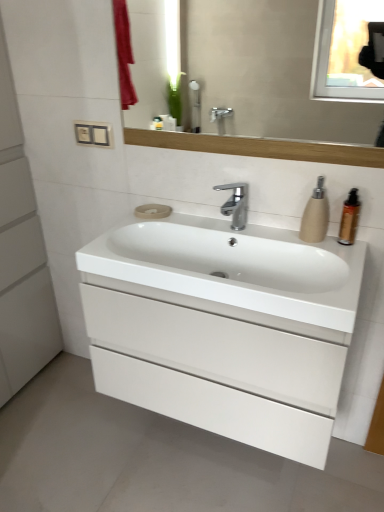
Question: Considering the relative sizes of brown glossy bottle at right and matte wooden mirror at upper center in the image provided, is brown glossy bottle at right thinner than matte wooden mirror at upper center?

Choices:
 (A) yes
 (B) no

Answer: (B)

Question: From a real-world perspective, is brown glossy bottle at right under matte wooden mirror at upper center?

Choices:
 (A) yes
 (B) no

Answer: (A)

Question: Considering the relative positions of brown glossy bottle at right and matte wooden mirror at upper center in the image provided, is brown glossy bottle at right to the right of matte wooden mirror at upper center from the viewer's perspective?

Choices:
 (A) no
 (B) yes

Answer: (B)

Question: Is brown glossy bottle at right facing towards matte wooden mirror at upper center?

Choices:
 (A) yes
 (B) no

Answer: (B)

Question: From a real-world perspective, is brown glossy bottle at right physically above matte wooden mirror at upper center?

Choices:
 (A) yes
 (B) no

Answer: (B)

Question: Can you confirm if brown glossy bottle at right is positioned to the left of matte wooden mirror at upper center?

Choices:
 (A) yes
 (B) no

Answer: (B)

Question: Considering the relative sizes of polished chrome faucet at center and matte beige soap dispenser at right in the image provided, is polished chrome faucet at center shorter than matte beige soap dispenser at right?

Choices:
 (A) yes
 (B) no

Answer: (A)

Question: Is polished chrome faucet at center positioned with its back to matte beige soap dispenser at right?

Choices:
 (A) yes
 (B) no

Answer: (B)

Question: Does polished chrome faucet at center lie behind matte beige soap dispenser at right?

Choices:
 (A) no
 (B) yes

Answer: (B)

Question: From a real-world perspective, is polished chrome faucet at center located higher than matte beige soap dispenser at right?

Choices:
 (A) no
 (B) yes

Answer: (A)

Question: From the image's perspective, would you say polished chrome faucet at center is shown under matte beige soap dispenser at right?

Choices:
 (A) no
 (B) yes

Answer: (A)

Question: Can you confirm if polished chrome faucet at center is wider than matte beige soap dispenser at right?

Choices:
 (A) yes
 (B) no

Answer: (A)

Question: From a real-world perspective, is matte wooden mirror at upper center physically below white glossy sink at center?

Choices:
 (A) no
 (B) yes

Answer: (A)